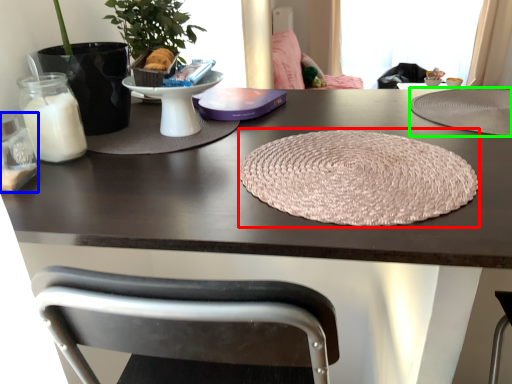
Question: Estimate the real-world distances between objects in this image. Which object is closer to yoga mat (highlighted by a red box), candle holder (highlighted by a blue box) or mat (highlighted by a green box)?

Choices:
 (A) candle holder
 (B) mat

Answer: (B)